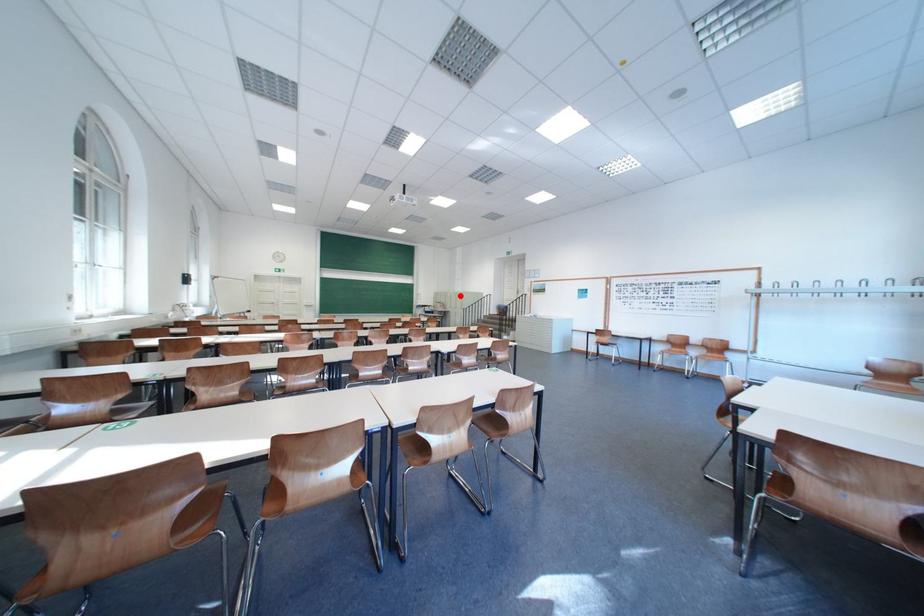
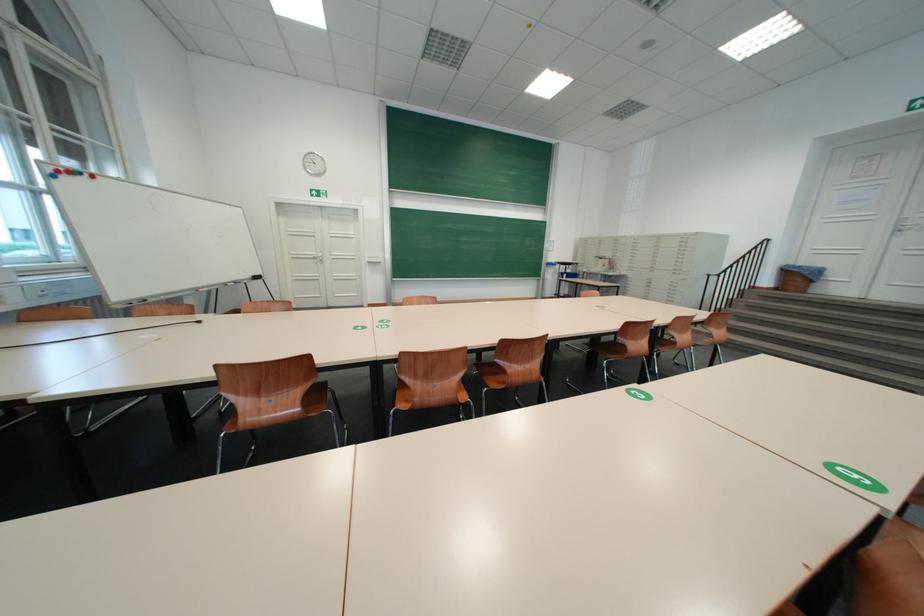
Find the pixel in the second image that matches the highlighted location in the first image.

(630, 241)